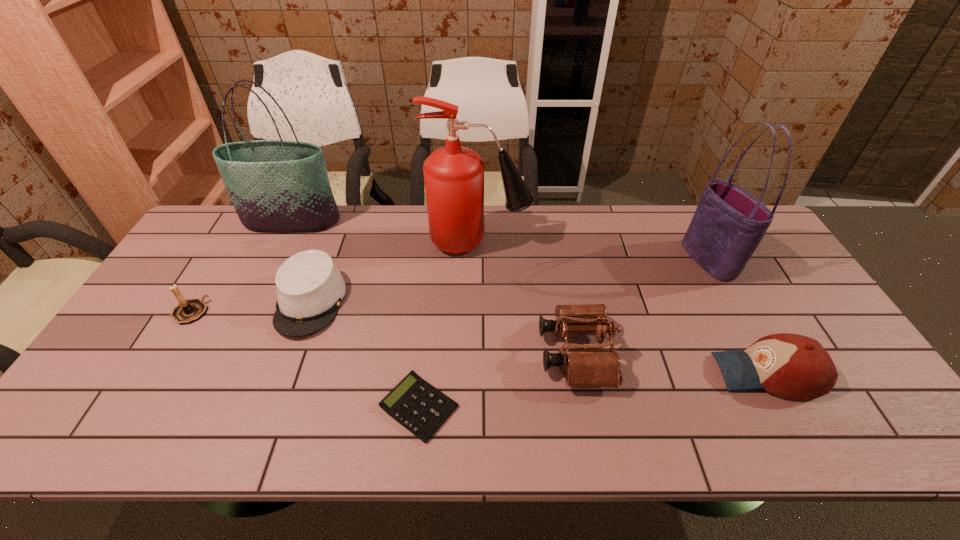
Identify the location of vacant space located 0.210m on the front of the nearer tote bag. (753, 341).

Find the location of a particular element. vacant space located 0.380m through the eyepieces of the binoculars is located at coordinates (393, 354).

The image size is (960, 540). What are the coordinates of `free region located 0.400m through the eyepieces of the binoculars` in the screenshot? It's located at (385, 354).

Locate an element on the screen. The width and height of the screenshot is (960, 540). blank area located through the eyepieces of the binoculars is located at coordinates (459, 354).

This screenshot has height=540, width=960. I want to click on free region located 0.110m on the front-facing side of the baseball cap, so click(x=671, y=373).

The image size is (960, 540). In order to click on vacant space located on the front-facing side of the baseball cap in this screenshot , I will do `click(679, 373)`.

Find the location of `vacant space located 0.090m on the front-facing side of the baseball cap`. vacant space located 0.090m on the front-facing side of the baseball cap is located at coordinates (679, 373).

The height and width of the screenshot is (540, 960). In order to click on vacant space located 0.210m on the front of the candle holder in this screenshot , I will do `click(140, 394)`.

I want to click on blank area located 0.280m on the front-facing side of the second shortest object, so click(258, 445).

This screenshot has width=960, height=540. What are the coordinates of `free location located on the right of the shortest object` in the screenshot? It's located at (609, 407).